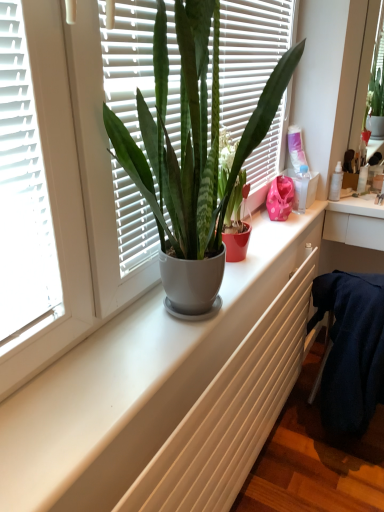
Question: Does white matte radiator at center have a greater height compared to matte white pot at center?

Choices:
 (A) yes
 (B) no

Answer: (B)

Question: From the image's perspective, would you say white matte radiator at center is shown under matte white pot at center?

Choices:
 (A) yes
 (B) no

Answer: (A)

Question: Can you confirm if white matte radiator at center is wider than matte white pot at center?

Choices:
 (A) no
 (B) yes

Answer: (B)

Question: From the image's perspective, is white matte radiator at center located above matte white pot at center?

Choices:
 (A) yes
 (B) no

Answer: (B)

Question: Is white matte radiator at center far from matte white pot at center?

Choices:
 (A) no
 (B) yes

Answer: (A)

Question: In the image, is white matte radiator at center positioned in front of or behind matte white pot at center?

Choices:
 (A) front
 (B) behind

Answer: (A)

Question: From the image's perspective, is white matte radiator at center above or below matte white pot at center?

Choices:
 (A) below
 (B) above

Answer: (A)

Question: Is point (160, 446) positioned closer to the camera than point (160, 168)?

Choices:
 (A) farther
 (B) closer

Answer: (B)

Question: In terms of width, does white matte radiator at center look wider or thinner when compared to matte white pot at center?

Choices:
 (A) thin
 (B) wide

Answer: (B)

Question: From the image's perspective, relative to transparent plastic bottle at upper right, is matte white pot at center above or below?

Choices:
 (A) below
 (B) above

Answer: (B)

Question: In the image, is matte white pot at center on the left side or the right side of transparent plastic bottle at upper right?

Choices:
 (A) right
 (B) left

Answer: (B)

Question: Considering the positions of point (183, 298) and point (297, 183), is point (183, 298) closer or farther from the camera than point (297, 183)?

Choices:
 (A) farther
 (B) closer

Answer: (B)

Question: From a real-world perspective, relative to transparent plastic bottle at upper right, is matte white pot at center vertically above or below?

Choices:
 (A) below
 (B) above

Answer: (B)

Question: Based on their positions, is transparent plastic bottle at upper right located to the left or right of white matte radiator at center?

Choices:
 (A) right
 (B) left

Answer: (A)

Question: From a real-world perspective, relative to white matte radiator at center, is transparent plastic bottle at upper right vertically above or below?

Choices:
 (A) below
 (B) above

Answer: (B)